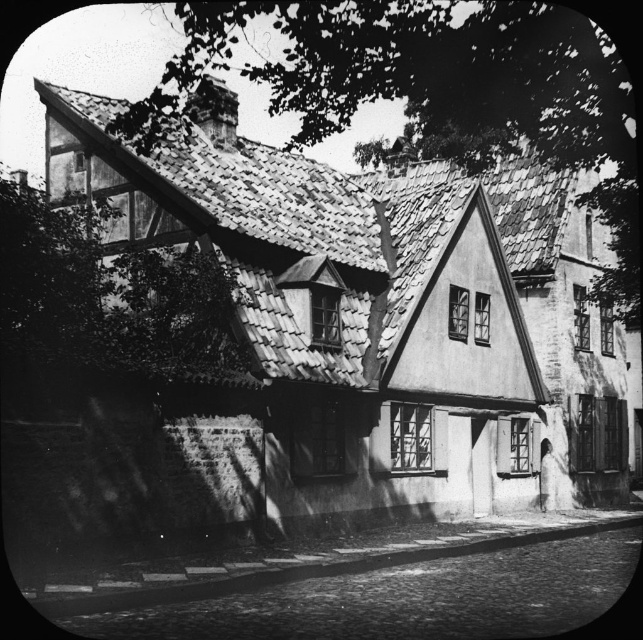
You are a window cleaner standing on a ladder near the green leafy tree at upper center and the green leafy tree at upper left. Which tree do you need to clean closer to because of its size?

The green leafy tree at upper center is larger in size than the green leafy tree at upper left, so you need to clean closer to the green leafy tree at upper center.

You are standing in front of the historic building and want to determine which of the two points, point (617, 234) or point (6, 292), is closer to you. Based on the image, which point is nearer?

Point (617, 234) is further to the viewer than point (6, 292), so point (6, 292) is closer to you.